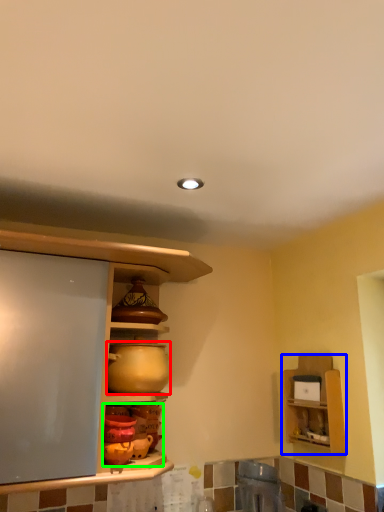
Question: Considering the real-world distances, which object is closest to appliance (highlighted by a red box)? shelf (highlighted by a blue box) or pottery (highlighted by a green box).

Choices:
 (A) shelf
 (B) pottery

Answer: (B)